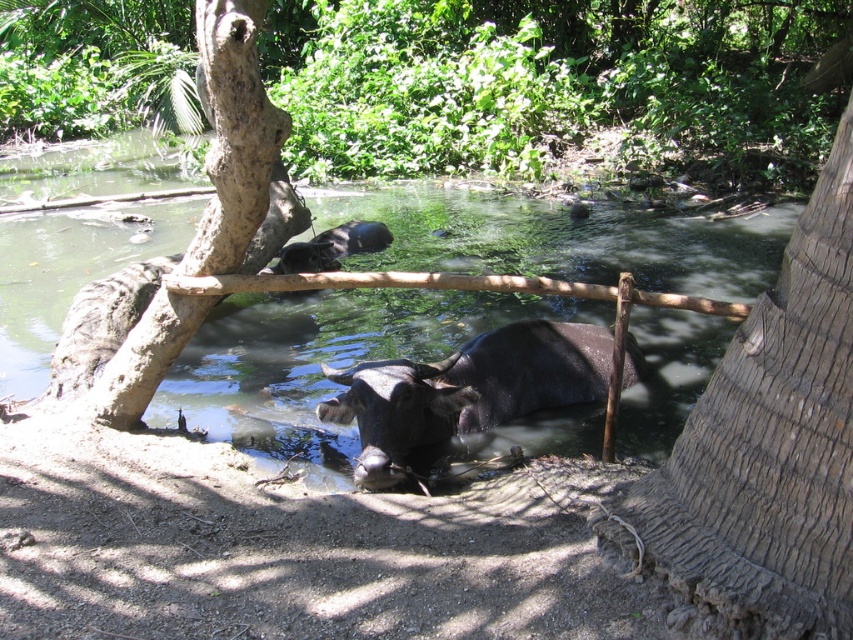
Question: Is clear water at center further to camera compared to shiny dark brown bull at center?

Choices:
 (A) yes
 (B) no

Answer: (A)

Question: Observing the image, what is the correct spatial positioning of clear water at center in reference to shiny dark brown bull at center?

Choices:
 (A) below
 (B) above

Answer: (B)

Question: Which of the following is the farthest from the observer?

Choices:
 (A) (334, 472)
 (B) (393, 368)

Answer: (A)

Question: Is clear water at center above shiny dark brown bull at center?

Choices:
 (A) no
 (B) yes

Answer: (B)

Question: Among these objects, which one is nearest to the camera?

Choices:
 (A) shiny dark brown bull at center
 (B) clear water at center

Answer: (A)